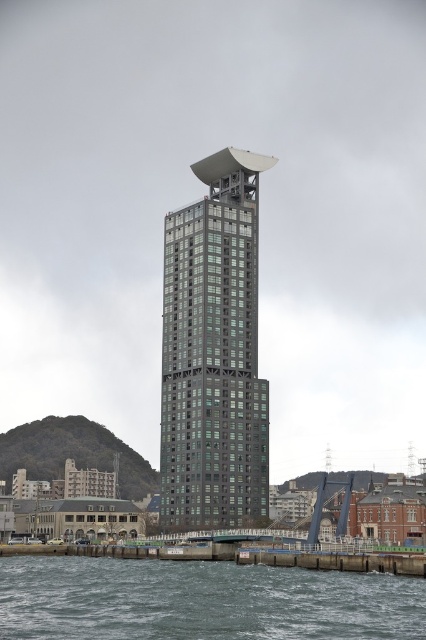
Question: Which point is closer to the camera taking this photo?

Choices:
 (A) (187, 440)
 (B) (29, 589)
 (C) (411, 564)

Answer: (B)

Question: Is transparent water at lower center bigger than smooth concrete dock at lower center?

Choices:
 (A) no
 (B) yes

Answer: (B)

Question: Observing the image, what is the correct spatial positioning of metallic glass bell tower at center in reference to transparent water at lower center?

Choices:
 (A) below
 (B) above

Answer: (B)

Question: Which point is farther to the camera?

Choices:
 (A) (265, 566)
 (B) (173, 346)

Answer: (B)

Question: Among these objects, which one is nearest to the camera?

Choices:
 (A) metallic glass bell tower at center
 (B) smooth concrete dock at lower center
 (C) transparent water at lower center

Answer: (C)

Question: Does metallic glass bell tower at center appear on the left side of smooth concrete dock at lower center?

Choices:
 (A) yes
 (B) no

Answer: (A)